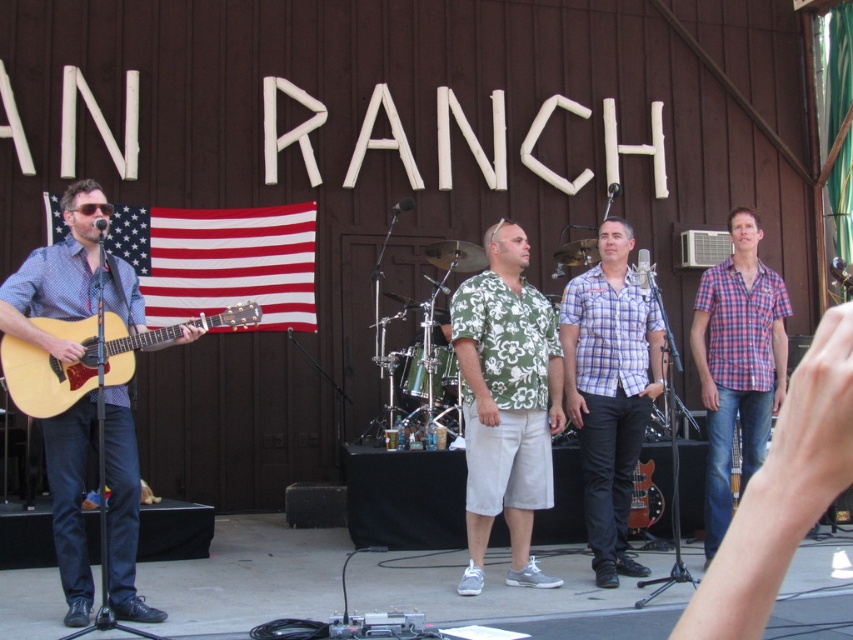
Who is lower down, green floral shirt at center or plaid shirt at right?

green floral shirt at center is lower down.

Image resolution: width=853 pixels, height=640 pixels. What do you see at coordinates (506, 403) in the screenshot? I see `green floral shirt at center` at bounding box center [506, 403].

Identify the location of green floral shirt at center. (506, 403).

Which is above, brushed wood guitar at left or plaid shirt at right?

plaid shirt at right

Is brushed wood guitar at left behind plaid shirt at right?

No, brushed wood guitar at left is in front of plaid shirt at right.

I want to click on brushed wood guitar at left, so click(x=70, y=276).

Can you confirm if brushed wood guitar at left is positioned to the right of glossy wood electric guitar at lower center?

No, brushed wood guitar at left is not to the right of glossy wood electric guitar at lower center.

This screenshot has width=853, height=640. What are the coordinates of `brushed wood guitar at left` in the screenshot? It's located at (70, 276).

I want to click on brushed wood guitar at left, so click(70, 276).